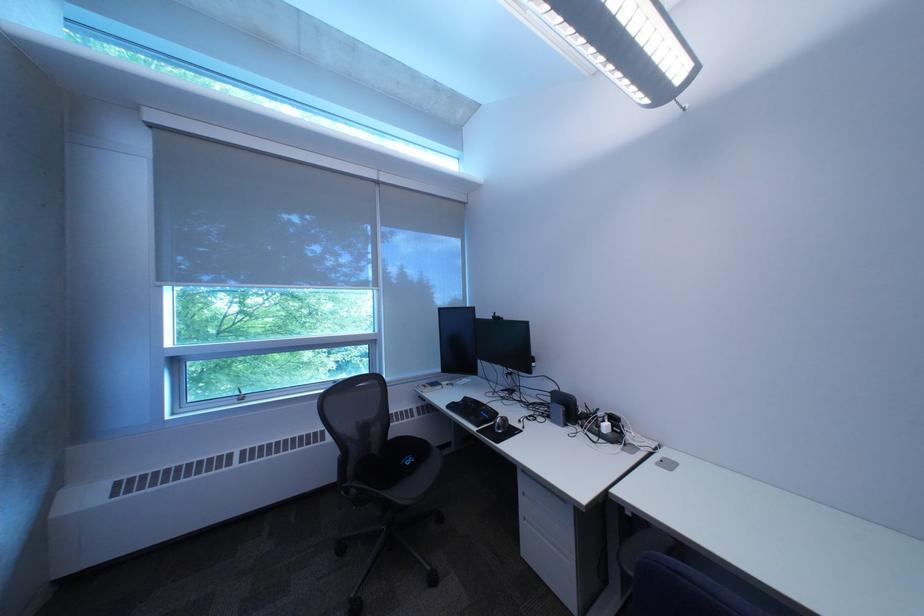
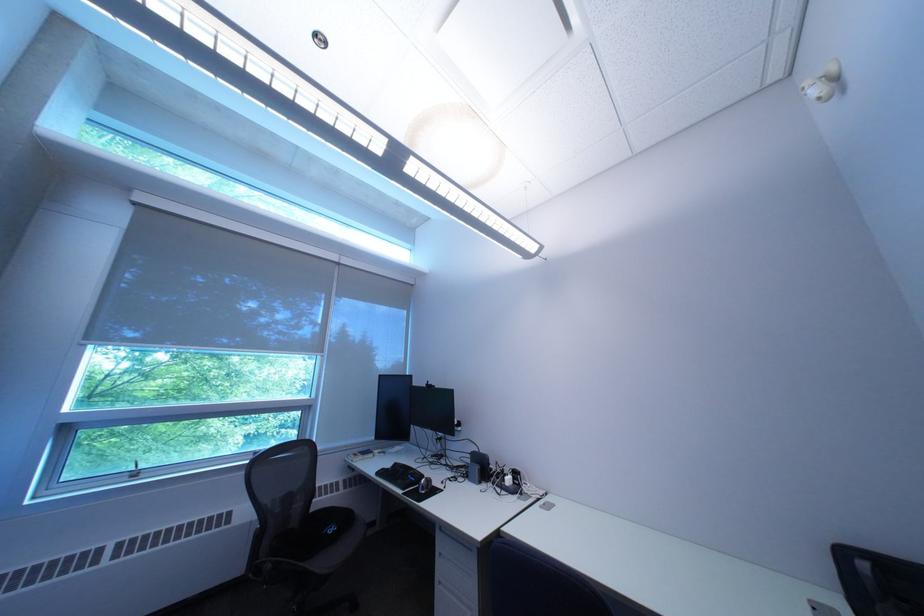
Question: What movement of the cameraman would produce the second image?

Choices:
 (A) Left
 (B) Right
 (C) Forward
 (D) Backward

Answer: (D)